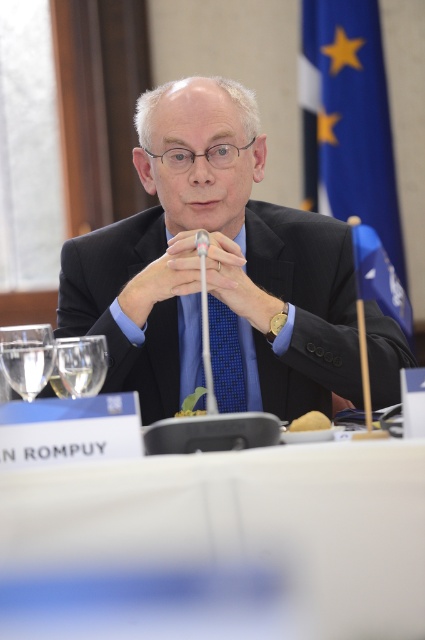
Question: Does white fabric table at center have a larger size compared to blue fabric flag at upper right?

Choices:
 (A) yes
 (B) no

Answer: (B)

Question: Based on their relative distances, which object is nearer to the blue textured tie at center?

Choices:
 (A) black glossy suit at center
 (B) clear glass wine glass at lower left
 (C) white fabric table at center

Answer: (A)

Question: Considering the relative positions of blue fabric flag at upper right and blue textured tie at center in the image provided, where is blue fabric flag at upper right located with respect to blue textured tie at center?

Choices:
 (A) above
 (B) below

Answer: (A)

Question: Among these objects, which one is farthest from the camera?

Choices:
 (A) blue fabric flag at right
 (B) black glossy suit at center
 (C) blue textured tie at center
 (D) white fabric table at center

Answer: (C)

Question: Can you confirm if clear glass wine glass at lower left is smaller than blue textured tie at center?

Choices:
 (A) yes
 (B) no

Answer: (A)

Question: Which object is the farthest from the blue textured tie at center?

Choices:
 (A) blue fabric flag at upper right
 (B) blue fabric flag at right

Answer: (A)